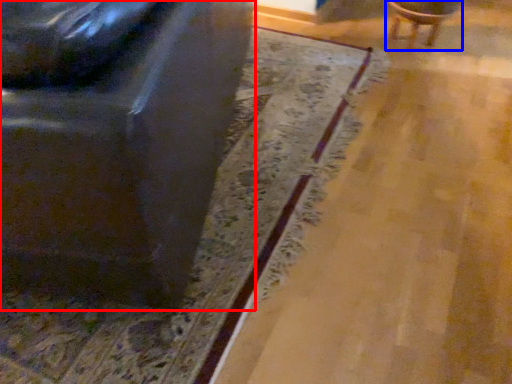
Question: Which of the following is the farthest to the observer, chair (highlighted by a red box) or chair (highlighted by a blue box)?

Choices:
 (A) chair
 (B) chair

Answer: (B)